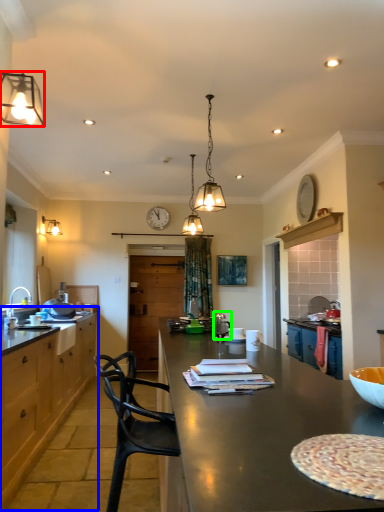
Question: Considering the real-world distances, which object is closest to lamp (highlighted by a red box)? cabinetry (highlighted by a blue box) or appliance (highlighted by a green box).

Choices:
 (A) cabinetry
 (B) appliance

Answer: (B)